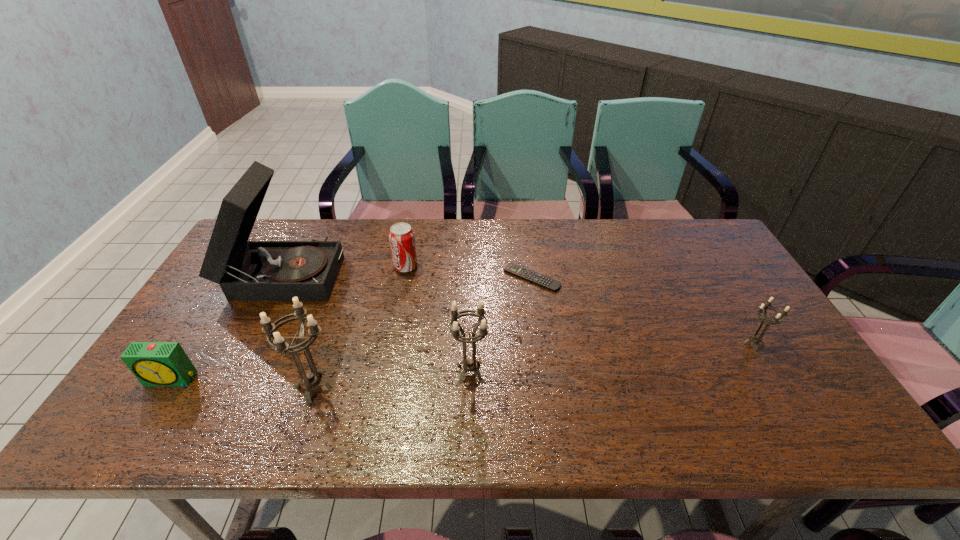
Choose which object is the fifth nearest neighbor to the phonograph_record. Please provide its 2D coordinates. Your answer should be formatted as a tuple, i.e. [(x, y)], where the tuple contains the x and y coordinates of a point satisfying the conditions above.

[(545, 282)]

Find the location of a particular element. object that is the third closest to the leftmost candle holder is located at coordinates (469, 365).

Point out which candle holder is positioned as the second nearest to the leftmost candle holder. Please provide its 2D coordinates. Your answer should be formatted as a tuple, i.e. [(x, y)], where the tuple contains the x and y coordinates of a point satisfying the conditions above.

[(756, 339)]

You are a GUI agent. You are given a task and a screenshot of the screen. Output one action in this format:
    pyautogui.click(x=<x>, y=<y>)
    Task: Click on the candle holder that can be found as the third closest to the alarm clock
    This screenshot has height=540, width=960.
    Given the screenshot: What is the action you would take?
    pyautogui.click(x=756, y=339)

The image size is (960, 540). I want to click on vacant area in the image that satisfies the following two spatial constraints: 1. on the back side of the rightmost candle holder; 2. on the front-facing side of the tallest object, so click(709, 272).

You are a GUI agent. You are given a task and a screenshot of the screen. Output one action in this format:
    pyautogui.click(x=<x>, y=<y>)
    Task: Click on the vacant area that satisfies the following two spatial constraints: 1. on the back side of the fifth object from left to right; 2. on the front-facing side of the tallest object
    Image resolution: width=960 pixels, height=540 pixels.
    Given the screenshot: What is the action you would take?
    pyautogui.click(x=472, y=272)

The height and width of the screenshot is (540, 960). What are the coordinates of `vacant point that satisfies the following two spatial constraints: 1. on the logo side of the shortest object; 2. on the left side of the soda can` in the screenshot? It's located at (404, 278).

This screenshot has height=540, width=960. I want to click on vacant point that satisfies the following two spatial constraints: 1. on the front-facing side of the phonograph_record; 2. on the left side of the leftmost candle holder, so click(226, 388).

The width and height of the screenshot is (960, 540). I want to click on vacant space that satisfies the following two spatial constraints: 1. on the back side of the third object from right to left; 2. on the front-facing side of the tallest object, so click(472, 272).

You are a GUI agent. You are given a task and a screenshot of the screen. Output one action in this format:
    pyautogui.click(x=<x>, y=<y>)
    Task: Click on the vacant space that satisfies the following two spatial constraints: 1. on the front-facing side of the tallest object; 2. on the back side of the shortest candle holder
    Image resolution: width=960 pixels, height=540 pixels.
    Given the screenshot: What is the action you would take?
    tap(248, 344)